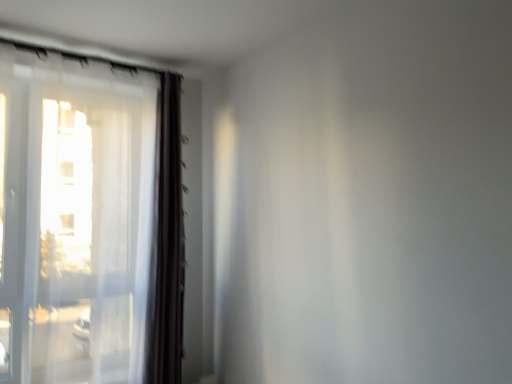
Question: Considering the relative positions of transparent fabric window at left and transparent plastic screen door at left in the image provided, is transparent fabric window at left in front of transparent plastic screen door at left?

Choices:
 (A) yes
 (B) no

Answer: (B)

Question: Is transparent fabric window at left to the left of transparent plastic screen door at left from the viewer's perspective?

Choices:
 (A) no
 (B) yes

Answer: (A)

Question: Is transparent fabric window at left shorter than transparent plastic screen door at left?

Choices:
 (A) no
 (B) yes

Answer: (A)

Question: From a real-world perspective, is transparent fabric window at left positioned over transparent plastic screen door at left based on gravity?

Choices:
 (A) yes
 (B) no

Answer: (B)

Question: Considering the relative positions of transparent fabric window at left and transparent plastic screen door at left in the image provided, is transparent fabric window at left behind transparent plastic screen door at left?

Choices:
 (A) yes
 (B) no

Answer: (A)

Question: Is transparent fabric window at left looking in the opposite direction of transparent plastic screen door at left?

Choices:
 (A) no
 (B) yes

Answer: (A)

Question: Is transparent fabric window at left taller than dark brown fabric curtain at left?

Choices:
 (A) no
 (B) yes

Answer: (B)

Question: Is dark brown fabric curtain at left completely or partially inside transparent fabric window at left?

Choices:
 (A) yes
 (B) no

Answer: (B)

Question: Can we say transparent fabric window at left lies outside dark brown fabric curtain at left?

Choices:
 (A) no
 (B) yes

Answer: (B)

Question: Is transparent fabric window at left bigger than dark brown fabric curtain at left?

Choices:
 (A) no
 (B) yes

Answer: (B)

Question: Would you consider transparent fabric window at left to be distant from dark brown fabric curtain at left?

Choices:
 (A) yes
 (B) no

Answer: (B)

Question: Is the position of transparent fabric window at left less distant than that of dark brown fabric curtain at left?

Choices:
 (A) yes
 (B) no

Answer: (A)

Question: From a real-world perspective, is dark brown fabric curtain at left positioned under transparent fabric window at left based on gravity?

Choices:
 (A) no
 (B) yes

Answer: (B)